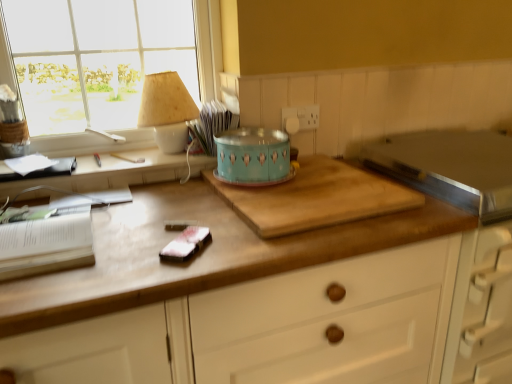
Question: Does wooden cutting board at center have a greater width compared to satin pink fabric at center?

Choices:
 (A) no
 (B) yes

Answer: (B)

Question: Is wooden cutting board at center not near satin pink fabric at center?

Choices:
 (A) yes
 (B) no

Answer: (B)

Question: Considering the relative sizes of wooden cutting board at center and satin pink fabric at center in the image provided, is wooden cutting board at center shorter than satin pink fabric at center?

Choices:
 (A) no
 (B) yes

Answer: (A)

Question: Is wooden cutting board at center not within satin pink fabric at center?

Choices:
 (A) yes
 (B) no

Answer: (A)

Question: Does wooden cutting board at center have a larger size compared to satin pink fabric at center?

Choices:
 (A) yes
 (B) no

Answer: (A)

Question: In terms of width, does wooden cutting board at center look wider or thinner when compared to satin pink fabric at center?

Choices:
 (A) thin
 (B) wide

Answer: (B)

Question: Is wooden cutting board at center bigger or smaller than satin pink fabric at center?

Choices:
 (A) small
 (B) big

Answer: (B)

Question: Considering the positions of point (272, 213) and point (203, 240), is point (272, 213) closer or farther from the camera than point (203, 240)?

Choices:
 (A) closer
 (B) farther

Answer: (B)

Question: Is wooden cutting board at center taller or shorter than satin pink fabric at center?

Choices:
 (A) short
 (B) tall

Answer: (B)

Question: Do you think wooden desk at lower left is within wooden cutting board at center, or outside of it?

Choices:
 (A) outside
 (B) inside

Answer: (A)

Question: Relative to wooden cutting board at center, is wooden desk at lower left in front or behind?

Choices:
 (A) behind
 (B) front

Answer: (A)

Question: From a real-world perspective, is wooden desk at lower left above or below wooden cutting board at center?

Choices:
 (A) below
 (B) above

Answer: (B)

Question: Is wooden desk at lower left to the left or to the right of wooden cutting board at center in the image?

Choices:
 (A) right
 (B) left

Answer: (B)

Question: Is wooden cutting board at center wider or thinner than clear glass window at upper left?

Choices:
 (A) thin
 (B) wide

Answer: (B)

Question: Considering the relative positions of wooden cutting board at center and clear glass window at upper left in the image provided, is wooden cutting board at center to the left or to the right of clear glass window at upper left?

Choices:
 (A) right
 (B) left

Answer: (A)